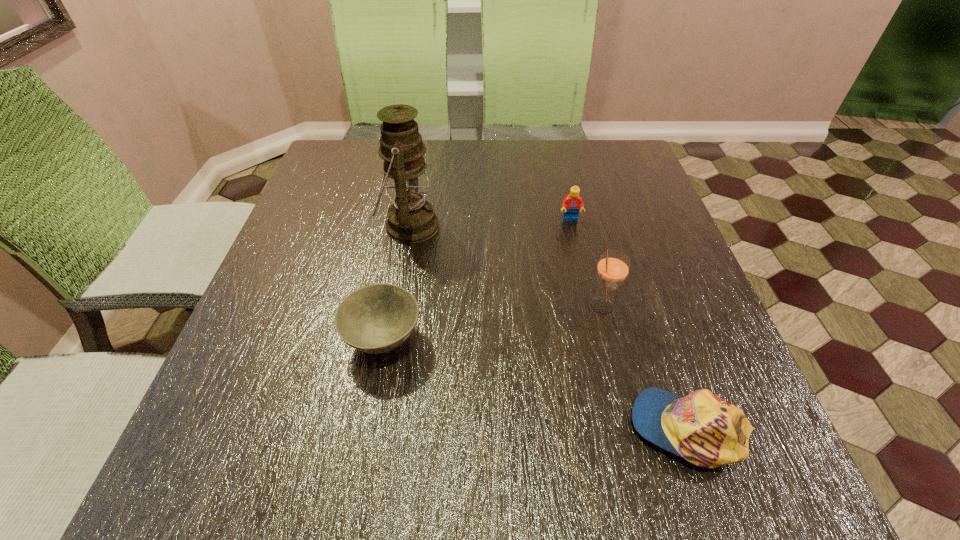
The height and width of the screenshot is (540, 960). Identify the location of object that is the second closest one to the Lego. (411, 219).

Identify the location of object that is the second closest to the straw. (571, 204).

The width and height of the screenshot is (960, 540). What are the coordinates of `vacant region that satisfies the following two spatial constraints: 1. on the face of the Lego; 2. on the left side of the straw` in the screenshot? It's located at (590, 307).

Find the location of `vacant space that satisfies the following two spatial constraints: 1. on the face of the Lego; 2. on the right side of the second tallest object`. vacant space that satisfies the following two spatial constraints: 1. on the face of the Lego; 2. on the right side of the second tallest object is located at coordinates (590, 307).